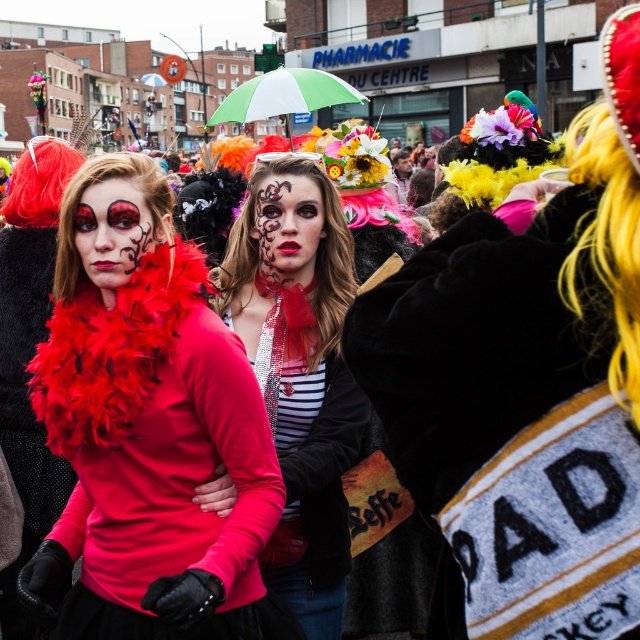
Question: Among these points, which one is farthest from the camera?

Choices:
 (A) (236, 305)
 (B) (404, 168)
 (C) (385, 406)
 (D) (316, 211)

Answer: (B)

Question: Which point appears closest to the camera in this image?

Choices:
 (A) (326, 77)
 (B) (116, 264)
 (C) (403, 163)

Answer: (B)

Question: Is matte black face paint at center below green and white striped umbrella at center?

Choices:
 (A) no
 (B) yes

Answer: (B)

Question: Where is matte black dress at center located in relation to matte red scarf at center in the image?

Choices:
 (A) below
 (B) above

Answer: (A)

Question: Is matte black dress at center positioned before matte red scarf at center?

Choices:
 (A) no
 (B) yes

Answer: (B)

Question: Which of the following is the closest to the observer?

Choices:
 (A) green and white striped umbrella at center
 (B) smooth skin face at center
 (C) matte black dress at center
 (D) black fur coat at center

Answer: (D)